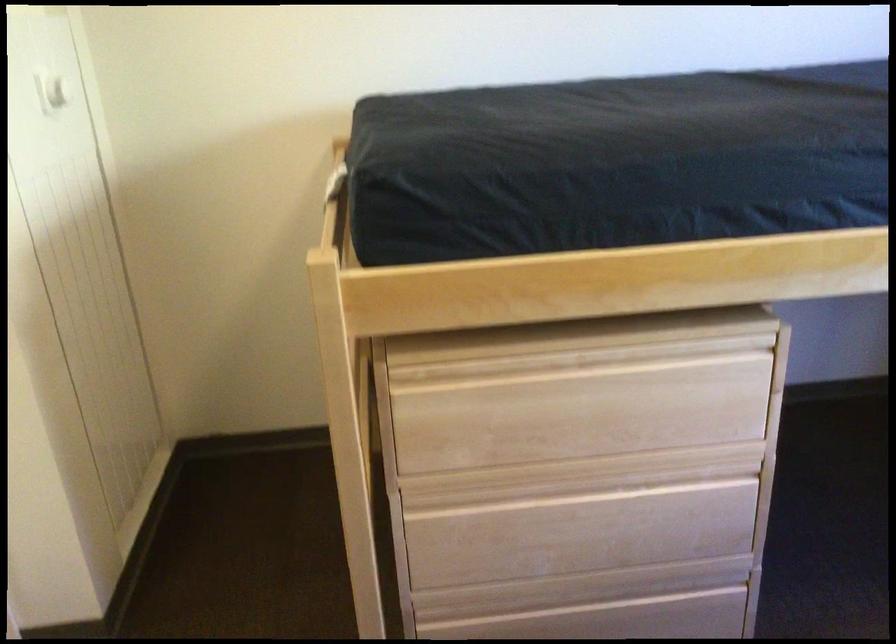
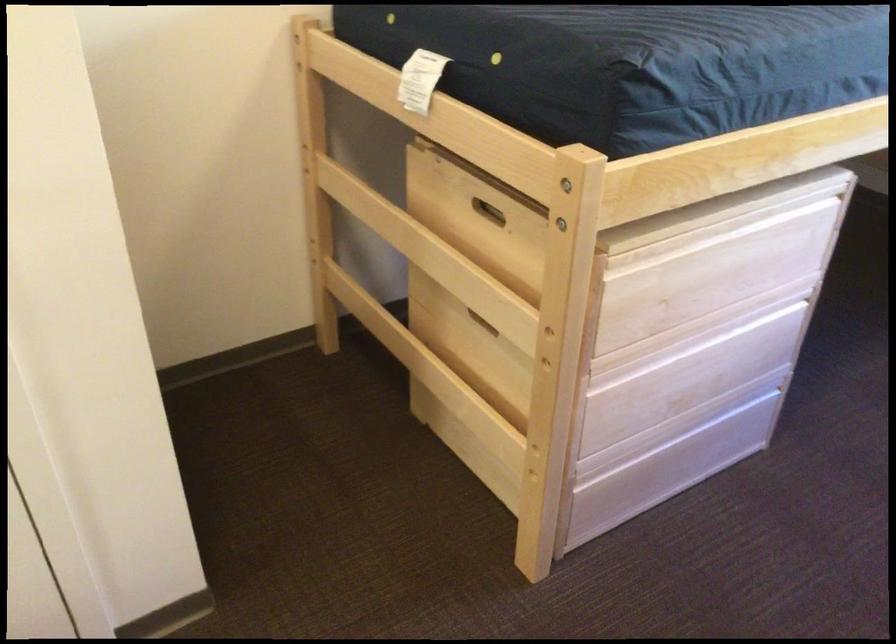
Where in the second image is the point corresponding to [571,359] from the first image?

(720, 230)